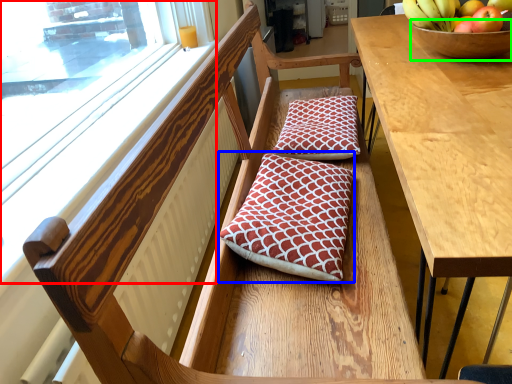
Question: Considering the real-world distances, which object is farthest from window (highlighted by a red box)? pillow (highlighted by a blue box) or glass bowl (highlighted by a green box)?

Choices:
 (A) pillow
 (B) glass bowl

Answer: (B)